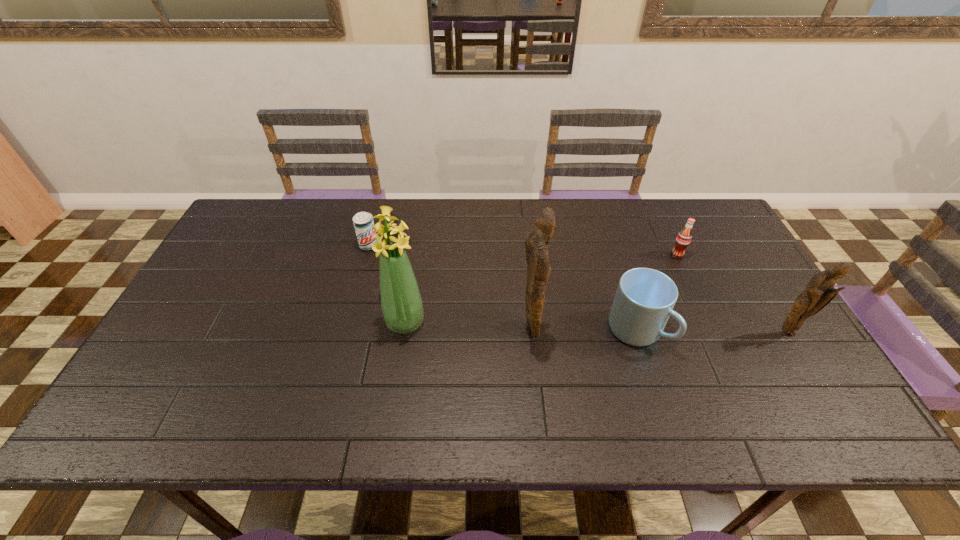
You are a GUI agent. You are given a task and a screenshot of the screen. Output one action in this format:
    pyautogui.click(x=<x>, y=<y>)
    Task: Click on the vacant region located 0.130m on the front-facing side of the third tallest object
    
    Given the screenshot: What is the action you would take?
    pyautogui.click(x=819, y=382)

What are the coordinates of `free space located on the back of the leftmost object` in the screenshot? It's located at (374, 224).

Find the location of a particular element. This screenshot has width=960, height=540. free space located on the front of the soda is located at coordinates (696, 296).

Locate an element on the screen. vacant space located 0.080m on the left of the third object from right to left is located at coordinates (578, 330).

Identify the location of vacant area situated 0.050m on the front-facing side of the second object from left to right. (400, 354).

The height and width of the screenshot is (540, 960). Find the location of `object that is at the far edge`. object that is at the far edge is located at coordinates (363, 222).

At what (x,y) coordinates should I click in order to perform the action: click on object present at the right edge. Please return your answer as a coordinate pair (x, y). The width and height of the screenshot is (960, 540). Looking at the image, I should click on (819, 292).

Find the location of a particular element. vacant space at the far edge of the desktop is located at coordinates (580, 233).

Locate an element on the screen. The image size is (960, 540). vacant space at the near edge of the desktop is located at coordinates (411, 376).

In the image, there is a desktop. Where is `free space at the left edge`? This screenshot has height=540, width=960. free space at the left edge is located at coordinates (186, 357).